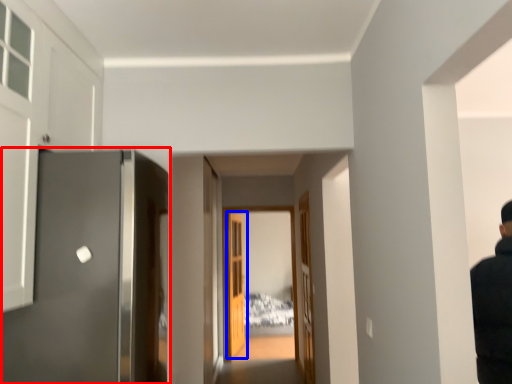
Question: Which point is closer to the camera, door (highlighted by a red box) or door (highlighted by a blue box)?

Choices:
 (A) door
 (B) door

Answer: (A)